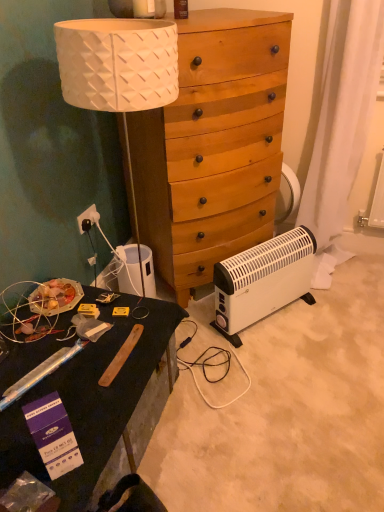
I want to click on vacant space in front of white plastic radiator at lower right, so click(x=280, y=370).